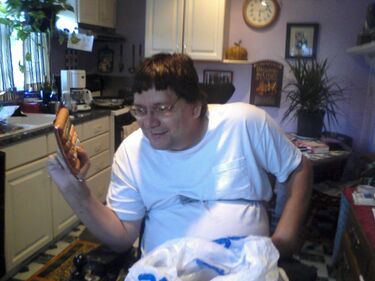
Image resolution: width=375 pixels, height=281 pixels. Identify the location of white cabinets. (27, 195).